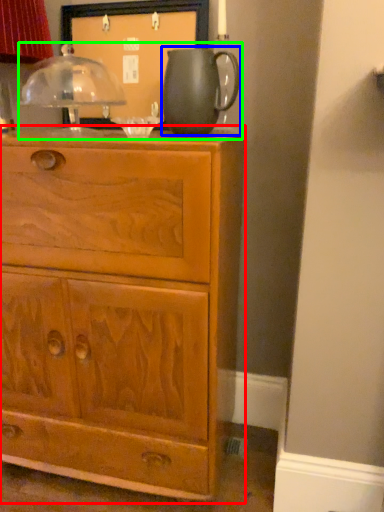
Question: Which object is the closest to the chest of drawers (highlighted by a red box)? Choose among these: jug (highlighted by a blue box) or tea set (highlighted by a green box).

Choices:
 (A) jug
 (B) tea set

Answer: (A)